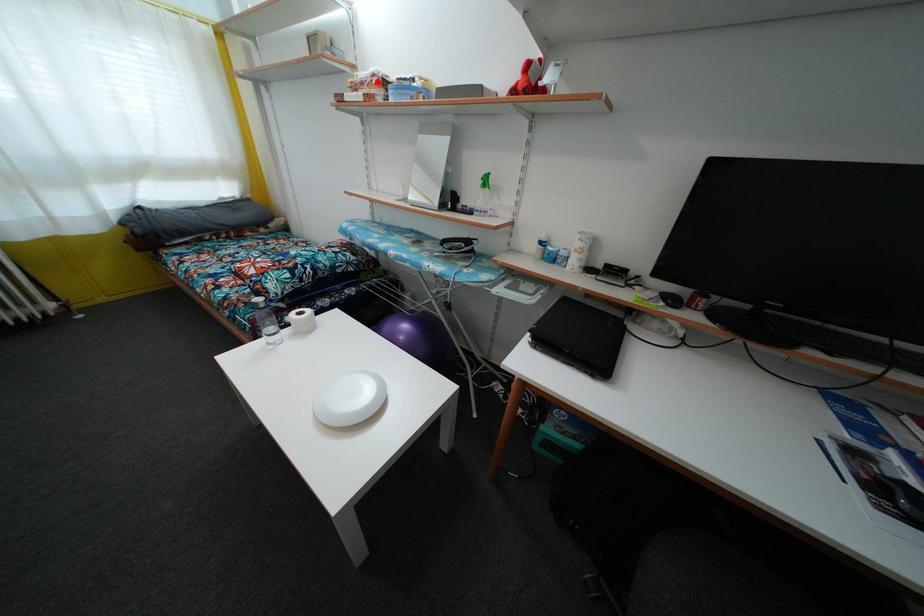
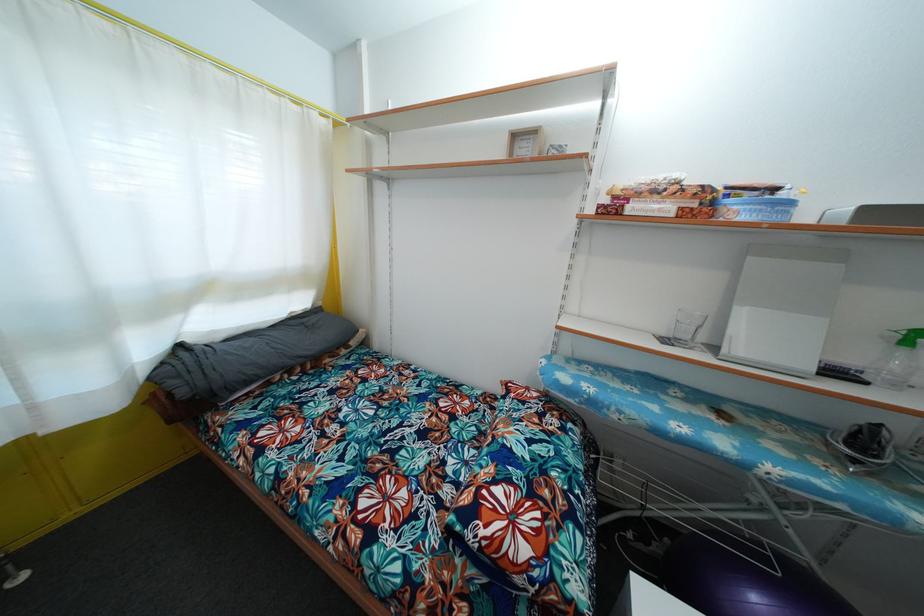
Where in the second image is the point corresponding to the highlighted location from the first image?

(683, 188)